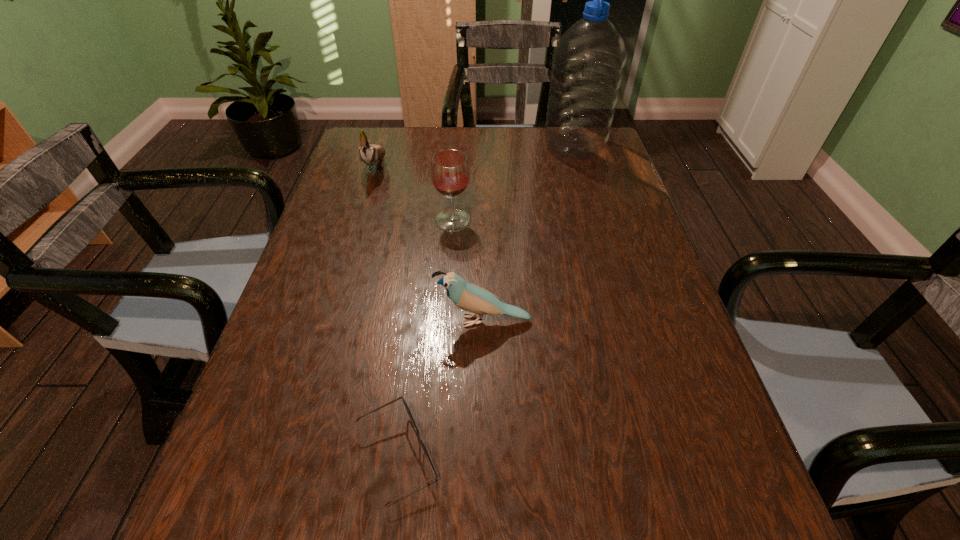
I want to click on free region located on the back of the third farthest object, so click(x=459, y=137).

Find the location of `vacant space located at the face of the left bird`. vacant space located at the face of the left bird is located at coordinates (360, 220).

This screenshot has width=960, height=540. Identify the location of free spot located 0.330m at the face of the right bird. (277, 321).

Where is `free space located at the face of the right bird`? This screenshot has height=540, width=960. free space located at the face of the right bird is located at coordinates (340, 321).

Where is `free space located at the face of the right bird`? free space located at the face of the right bird is located at coordinates (297, 321).

I want to click on free space located 0.150m with the lenses facing outward on the shortest object, so click(x=531, y=456).

This screenshot has width=960, height=540. In order to click on water jug at the far edge in this screenshot , I will do `click(588, 63)`.

Identify the location of bird at the far edge. (370, 154).

Where is `object that is positioned at the left edge`? object that is positioned at the left edge is located at coordinates (370, 154).

Image resolution: width=960 pixels, height=540 pixels. I want to click on object located in the right edge section of the desktop, so click(x=588, y=63).